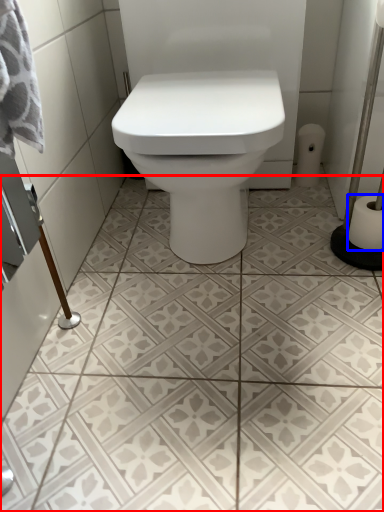
Question: Which of the following is the closest to the observer, ceramic tile (highlighted by a red box) or toilet paper (highlighted by a blue box)?

Choices:
 (A) ceramic tile
 (B) toilet paper

Answer: (A)